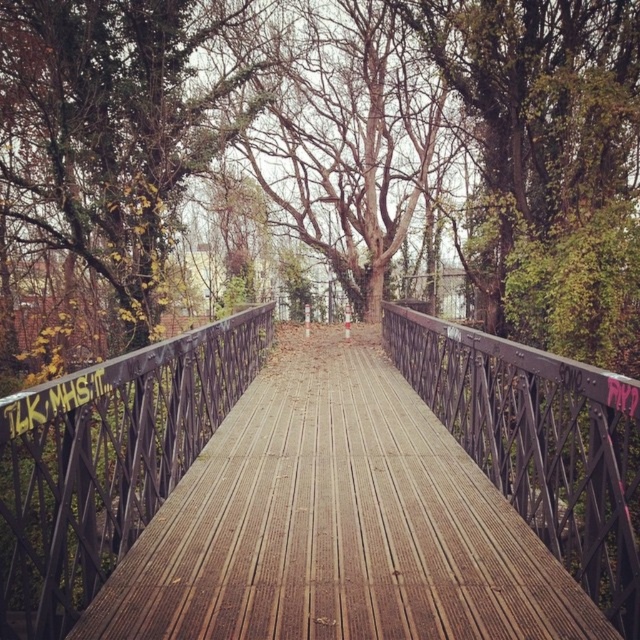
Question: Which object appears farthest from the camera in this image?

Choices:
 (A) bare wood tree at center
 (B) metallic black railing at center

Answer: (A)

Question: Does wooden planks at center appear under green ivy-covered tree at upper left?

Choices:
 (A) yes
 (B) no

Answer: (A)

Question: Considering the real-world distances, which object is closest to the wooden planks at center?

Choices:
 (A) green ivy-covered tree at upper left
 (B) metallic black railing at center
 (C) bare wood tree at center
 (D) dark gray metal rail at center

Answer: (D)

Question: Can you confirm if green ivy-covered tree at upper left is bigger than dark gray metal rail at center?

Choices:
 (A) yes
 (B) no

Answer: (A)

Question: Which of the following is the closest to the observer?

Choices:
 (A) (428, 321)
 (B) (371, 13)
 (C) (108, 16)

Answer: (A)

Question: Is green ivy-covered tree at upper left bigger than metallic black railing at center?

Choices:
 (A) no
 (B) yes

Answer: (B)